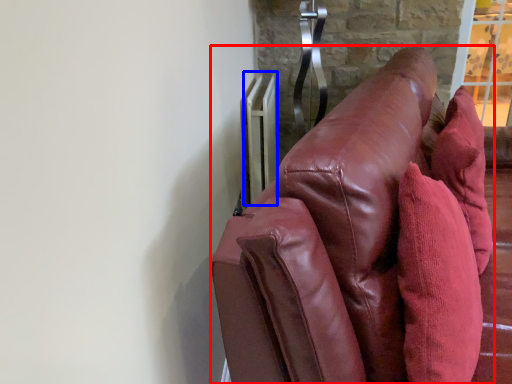
Question: Which object is closer to the camera taking this photo, furniture (highlighted by a red box) or radiator (highlighted by a blue box)?

Choices:
 (A) furniture
 (B) radiator

Answer: (A)